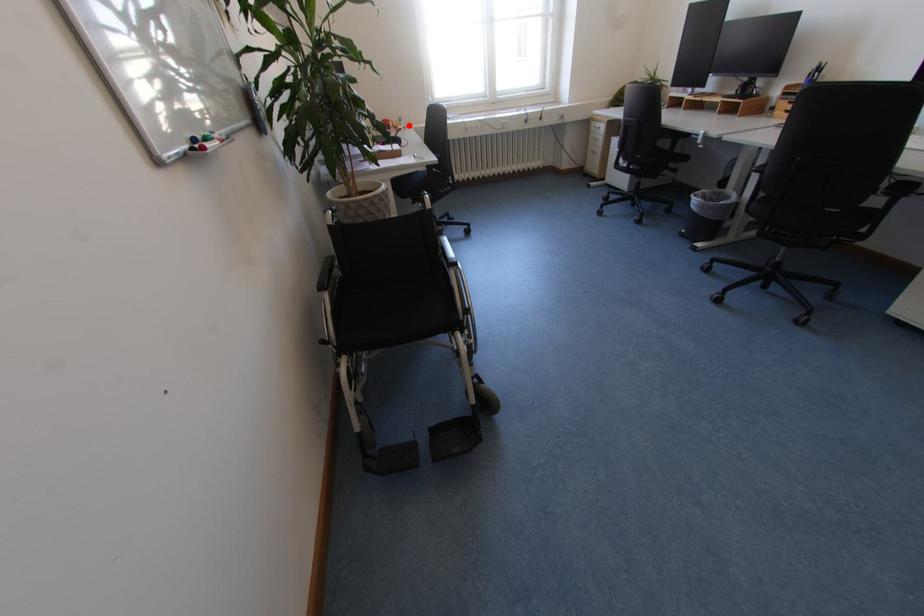
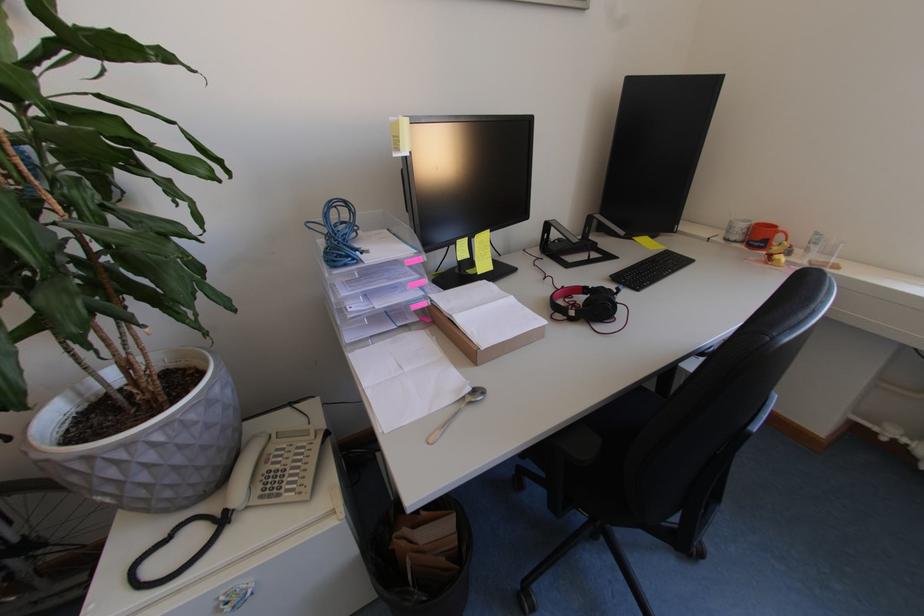
Question: A red point is marked in image1. In image2, is the corresponding 3D point closer to the camera or farther? Reply with the corresponding letter.

Choices:
 (A) The corresponding 3D point is closer.
 (B) The corresponding 3D point is farther.

Answer: (B)